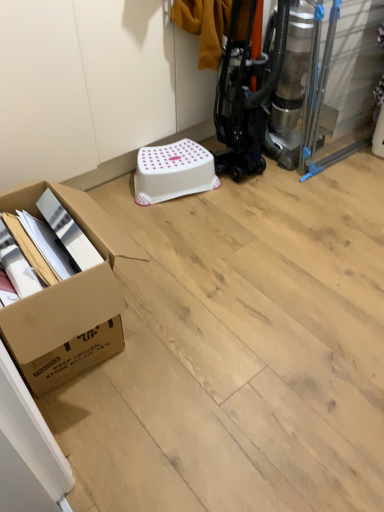
Locate an element on the screen. The image size is (384, 512). free spot in front of white plastic stool at center is located at coordinates (183, 221).